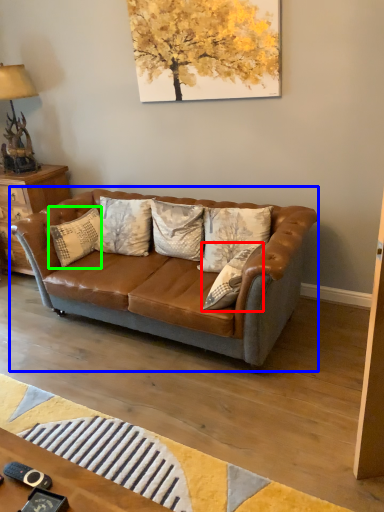
Question: Which object is the closest to the pillow (highlighted by a red box)? Choose among these: studio couch (highlighted by a blue box) or pillow (highlighted by a green box).

Choices:
 (A) studio couch
 (B) pillow

Answer: (A)